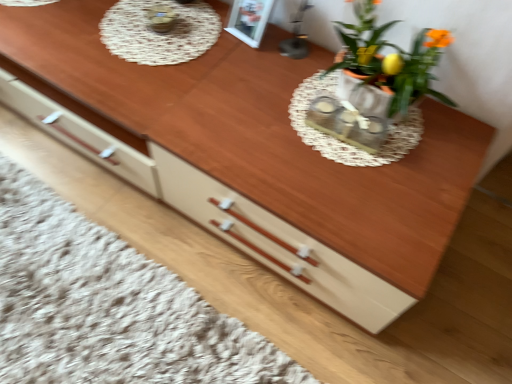
Question: Can white lace doily at upper center be found inside matte white flowerpot at upper right?

Choices:
 (A) no
 (B) yes

Answer: (A)

Question: From the image's perspective, is matte white flowerpot at upper right beneath white lace doily at upper center?

Choices:
 (A) no
 (B) yes

Answer: (B)

Question: From a real-world perspective, is matte white flowerpot at upper right beneath white lace doily at upper center?

Choices:
 (A) no
 (B) yes

Answer: (A)

Question: Is matte white flowerpot at upper right at the left side of white lace doily at upper center?

Choices:
 (A) yes
 (B) no

Answer: (B)

Question: From a real-world perspective, is matte white flowerpot at upper right over white lace doily at upper center?

Choices:
 (A) no
 (B) yes

Answer: (B)

Question: Is white lace doily at upper center in front of or behind matte orange pot at upper right in the image?

Choices:
 (A) front
 (B) behind

Answer: (B)

Question: Does point (185, 26) appear closer or farther from the camera than point (385, 82)?

Choices:
 (A) closer
 (B) farther

Answer: (B)

Question: Based on their sizes in the image, would you say white lace doily at upper center is bigger or smaller than matte orange pot at upper right?

Choices:
 (A) small
 (B) big

Answer: (A)

Question: From the image's perspective, is white lace doily at upper center located above or below matte orange pot at upper right?

Choices:
 (A) below
 (B) above

Answer: (B)

Question: From their relative heights in the image, would you say matte white flowerpot at upper right is taller or shorter than white lace doily at upper center?

Choices:
 (A) short
 (B) tall

Answer: (B)

Question: Considering the relative positions of matte white flowerpot at upper right and white lace doily at upper center in the image provided, is matte white flowerpot at upper right to the left or to the right of white lace doily at upper center?

Choices:
 (A) right
 (B) left

Answer: (A)

Question: Which is correct: matte white flowerpot at upper right is inside white lace doily at upper center, or outside of it?

Choices:
 (A) inside
 (B) outside

Answer: (B)

Question: Considering their positions, is matte white flowerpot at upper right located in front of or behind white lace doily at upper center?

Choices:
 (A) behind
 (B) front

Answer: (B)

Question: Considering the positions of matte orange pot at upper right and white lace doily at upper center in the image, is matte orange pot at upper right bigger or smaller than white lace doily at upper center?

Choices:
 (A) big
 (B) small

Answer: (A)

Question: From the image's perspective, relative to white lace doily at upper center, is matte orange pot at upper right above or below?

Choices:
 (A) above
 (B) below

Answer: (B)